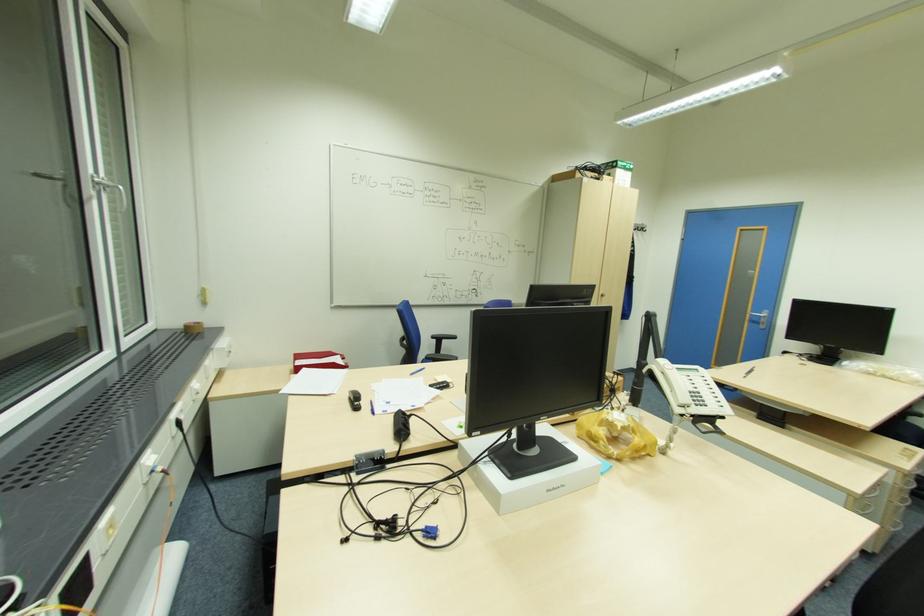
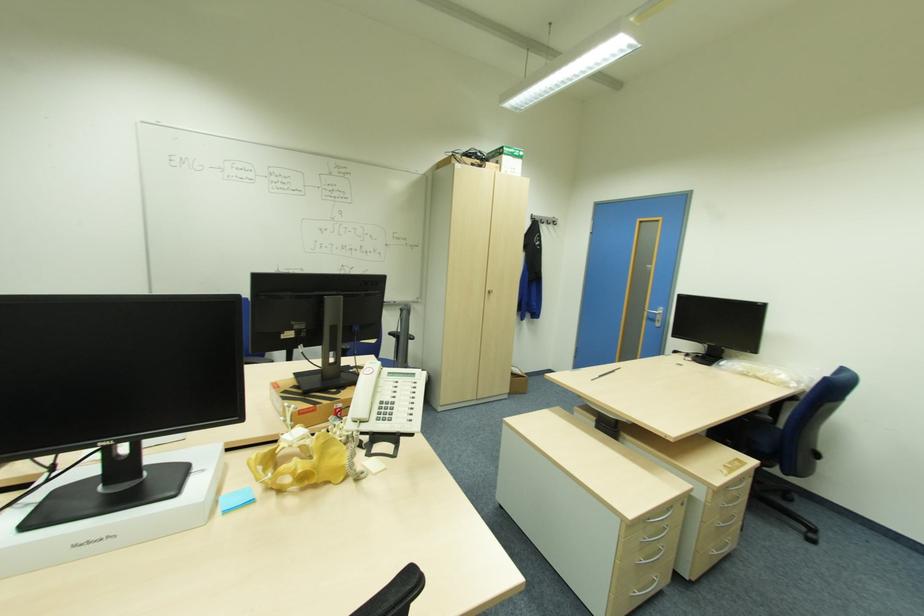
In the second image, find the point that corresponds to pixel 687 406 in the first image.

(359, 422)